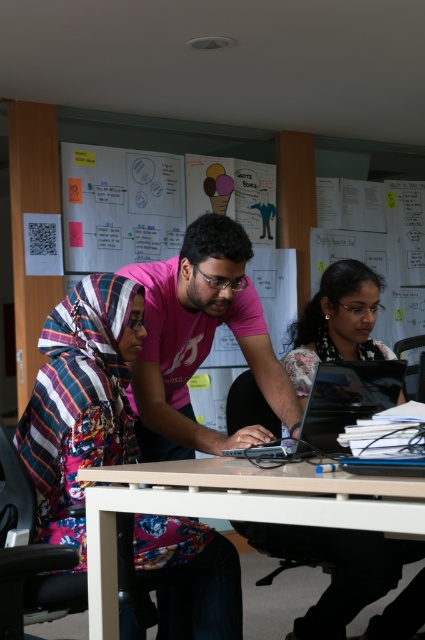
Question: Does matte black laptop at center come behind white glossy table at center?

Choices:
 (A) yes
 (B) no

Answer: (A)

Question: Among these points, which one is farthest from the camera?

Choices:
 (A) (90, 340)
 (B) (224, 513)

Answer: (A)

Question: Does patterned fabric hijab at center have a smaller size compared to matte black laptop at center?

Choices:
 (A) yes
 (B) no

Answer: (B)

Question: Can you confirm if pink matte shirt at center is smaller than matte black laptop at center?

Choices:
 (A) yes
 (B) no

Answer: (B)

Question: Among these objects, which one is nearest to the camera?

Choices:
 (A) glossy black laptop at center
 (B) patterned fabric hijab at center
 (C) pink matte shirt at center

Answer: (A)

Question: Which of the following is the closest to the observer?

Choices:
 (A) (300, 524)
 (B) (193, 536)
 (C) (167, 317)

Answer: (A)